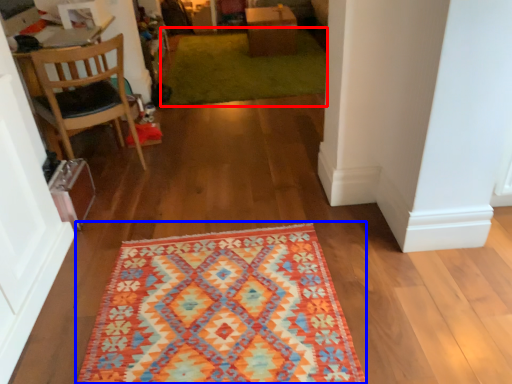
Question: Which object appears closest to the camera in this image, doormat (highlighted by a red box) or mat (highlighted by a blue box)?

Choices:
 (A) doormat
 (B) mat

Answer: (B)